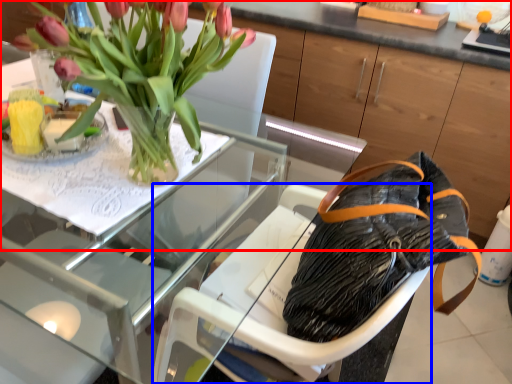
Question: Which object appears farthest to the camera in this image, dresser (highlighted by a red box) or armchair (highlighted by a blue box)?

Choices:
 (A) dresser
 (B) armchair

Answer: (A)